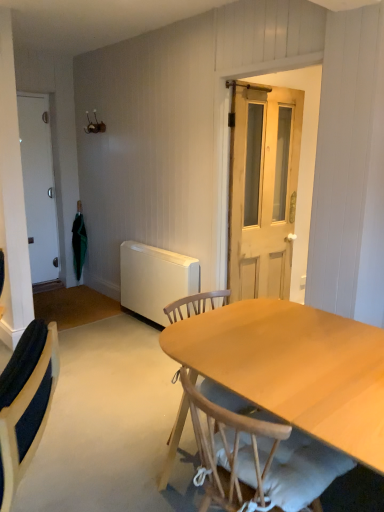
Question: In the image, is white matte door at left, positioned as the 2th door in right-to-left order, on the left side or the right side of white fabric tablecloth at center?

Choices:
 (A) right
 (B) left

Answer: (B)

Question: Would you say white matte door at left, acting as the 1th door starting from the back, is inside or outside white fabric tablecloth at center?

Choices:
 (A) inside
 (B) outside

Answer: (B)

Question: Estimate the real-world distances between objects in this image. Which object is closer to the velvet blue chair at lower left, positioned as the 2th chair in right-to-left order?

Choices:
 (A) light brown wooden door at center, placed as the 2th door when sorted from left to right
 (B) white matte radiator at lower left
 (C) white matte door at left, the second door viewed from the front
 (D) green fabric umbrella at left
 (E) wooden chair at center, which is the 1th chair in right-to-left order

Answer: (E)

Question: Which object is positioned farthest from the light brown wooden door at center, the second door in the back-to-front sequence?

Choices:
 (A) white matte radiator at lower left
 (B) velvet blue chair at lower left, positioned as the 2th chair in right-to-left order
 (C) white matte door at left, positioned as the 2th door in right-to-left order
 (D) wooden chair at center, which is the second chair from left to right
 (E) green fabric umbrella at left

Answer: (C)